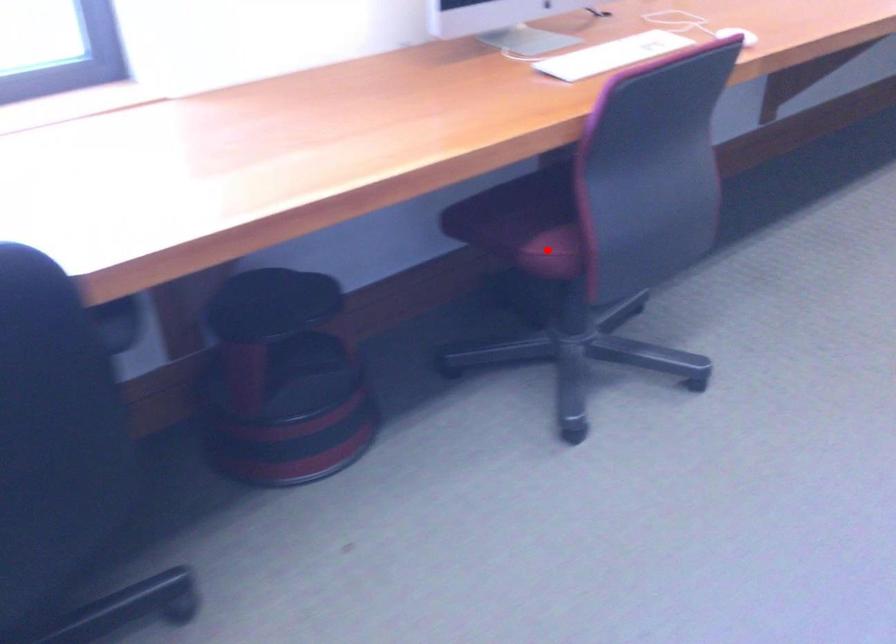
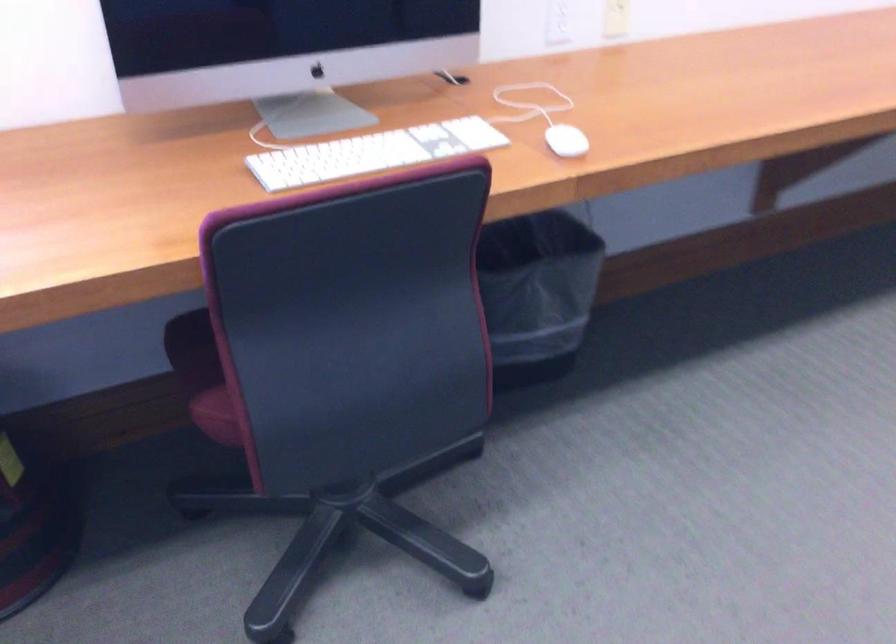
The point at the highlighted location is marked in the first image. Where is the corresponding point in the second image?

(220, 413)